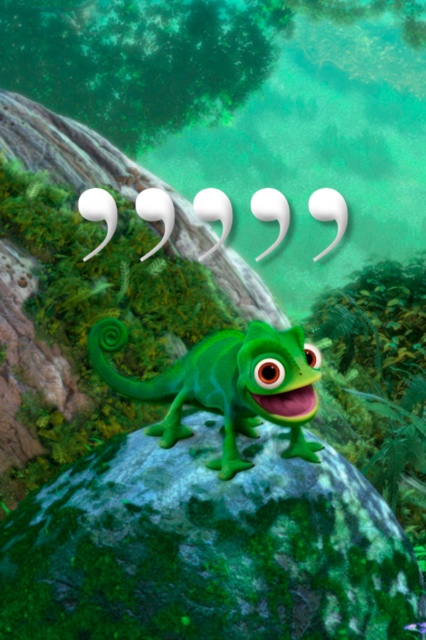
Question: Is green mossy rock at center thinner than green rubber lizard at center?

Choices:
 (A) no
 (B) yes

Answer: (A)

Question: From the image, what is the correct spatial relationship of green mossy rock at center in relation to green rubber lizard at center?

Choices:
 (A) above
 (B) below

Answer: (B)

Question: Among these points, which one is nearest to the camera?

Choices:
 (A) (204, 392)
 (B) (420, 595)

Answer: (B)

Question: Can you confirm if green mossy rock at center is bigger than green rubber lizard at center?

Choices:
 (A) no
 (B) yes

Answer: (B)

Question: Which point is closer to the camera?

Choices:
 (A) green rubber lizard at center
 (B) green mossy rock at center

Answer: (B)

Question: Which of the following is the closest to the observer?

Choices:
 (A) green rubber lizard at center
 (B) green mossy rock at center

Answer: (B)